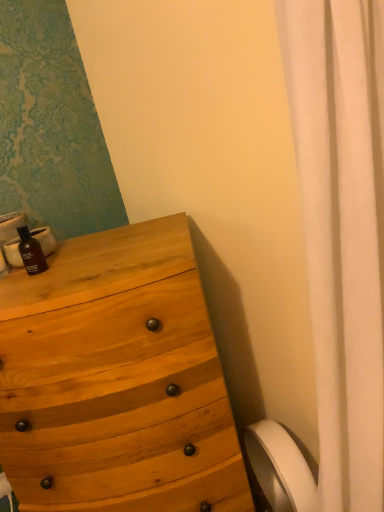
Where is `free location above natural wood chest of drawers at left (from a real-world perspective)`? The height and width of the screenshot is (512, 384). free location above natural wood chest of drawers at left (from a real-world perspective) is located at coordinates [91, 257].